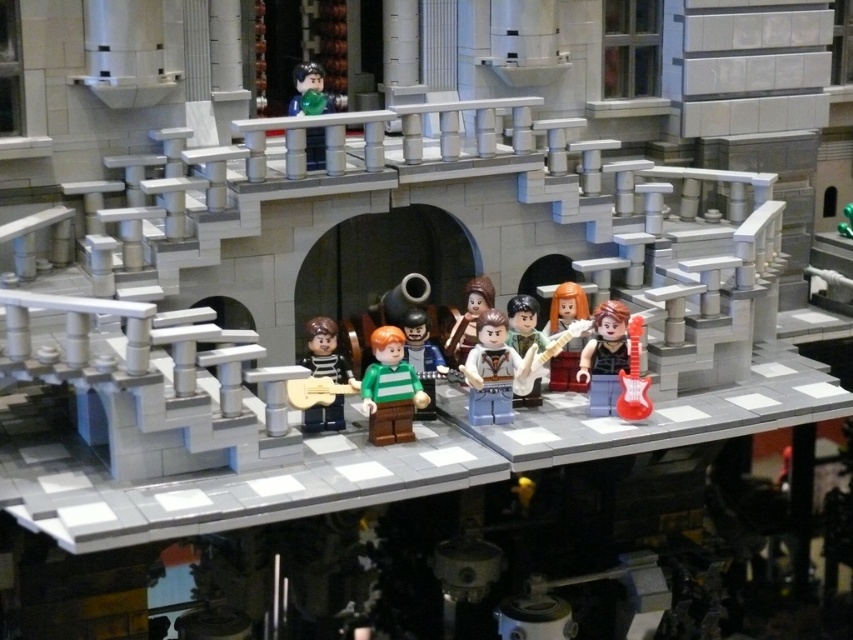
Between light brown wood guitar at center and smooth green shirt at center, which one has more height?

smooth green shirt at center

Can you confirm if light brown wood guitar at center is positioned to the right of smooth green shirt at center?

Yes, light brown wood guitar at center is to the right of smooth green shirt at center.

In order to click on light brown wood guitar at center in this screenshot , I will do 494,371.

Between point (335, 413) and point (602, 301), which one is positioned behind?

Positioned behind is point (602, 301).

Does point (323, 323) come farther from viewer compared to point (602, 360)?

That is False.

Where is `striped fabric guitar at center`? Image resolution: width=853 pixels, height=640 pixels. striped fabric guitar at center is located at coordinates (325, 353).

You are a GUI agent. You are given a task and a screenshot of the screen. Output one action in this format:
    pyautogui.click(x=<x>, y=<y>)
    Task: Click on the striped fabric guitar at center
    
    Given the screenshot: What is the action you would take?
    pyautogui.click(x=325, y=353)

Can you confirm if green matte figure at center is positioned below smooth plastic guitar at center?

Yes.

Does green matte figure at center have a greater width compared to smooth plastic guitar at center?

Correct, the width of green matte figure at center exceeds that of smooth plastic guitar at center.

Does point (409, 429) lie behind point (541, 340)?

That is False.

At what (x,y) coordinates should I click in order to perform the action: click on green matte figure at center. Please return your answer as a coordinate pair (x, y). Looking at the image, I should click on (390, 388).